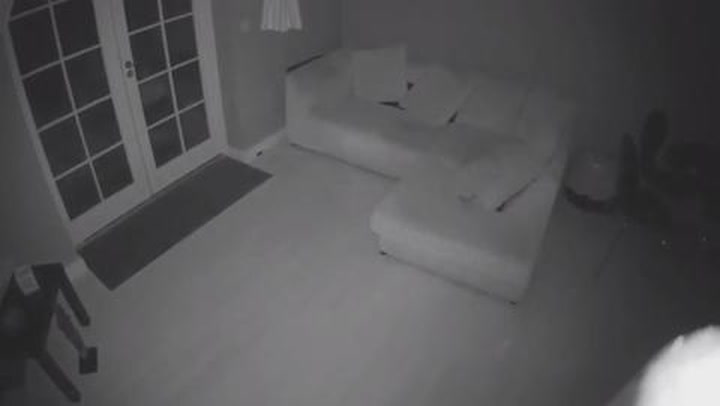
Locate an element on the screen. The height and width of the screenshot is (406, 720). sofa is located at coordinates (404, 139).